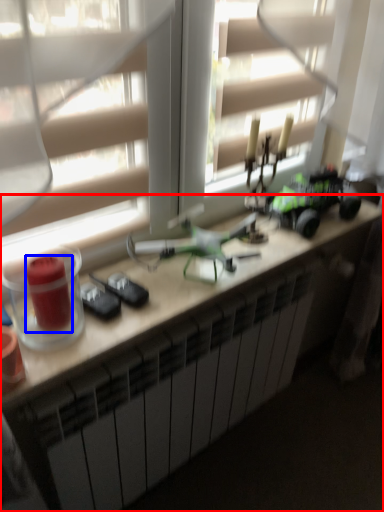
Question: Which point is further to the camera, desk (highlighted by a red box) or candle holder (highlighted by a blue box)?

Choices:
 (A) desk
 (B) candle holder

Answer: (A)